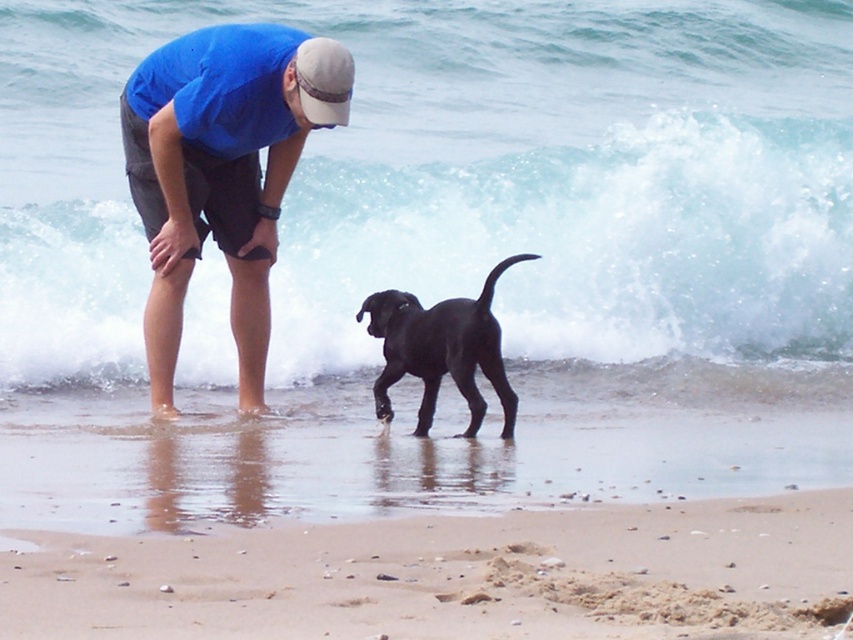
Which is in front, point (538, 568) or point (450, 305)?

Positioned in front is point (538, 568).

Does sandy at lower center have a smaller size compared to black matte dog at center?

No, sandy at lower center is not smaller than black matte dog at center.

Between point (572, 624) and point (490, 320), which one is positioned behind?

Point (490, 320)

I want to click on sandy at lower center, so click(x=453, y=577).

Does sandy at lower center appear on the right side of white fabric baseball cap at upper center?

Indeed, sandy at lower center is positioned on the right side of white fabric baseball cap at upper center.

Is point (99, 541) closer to viewer compared to point (347, 112)?

Yes.

Measure the distance between sandy at lower center and camera.

A distance of 4.62 meters exists between sandy at lower center and camera.

Where is `sandy at lower center`? This screenshot has width=853, height=640. sandy at lower center is located at coordinates (453, 577).

The height and width of the screenshot is (640, 853). What do you see at coordinates (440, 349) in the screenshot?
I see `black matte dog at center` at bounding box center [440, 349].

Is black matte dog at center to the left of white fabric baseball cap at upper center from the viewer's perspective?

Incorrect, black matte dog at center is not on the left side of white fabric baseball cap at upper center.

Between point (480, 401) and point (350, 88), which one is positioned behind?

Point (480, 401)

The image size is (853, 640). What are the coordinates of `black matte dog at center` in the screenshot? It's located at (440, 349).